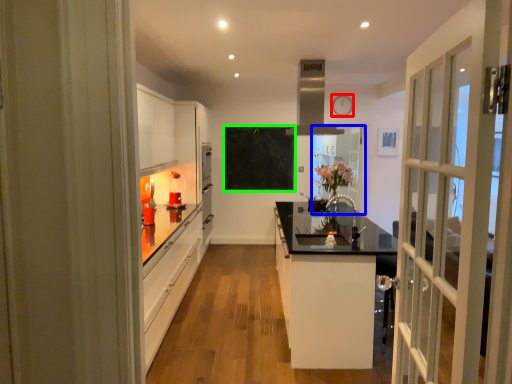
Question: Which object is the farthest from clock (highlighted by a red box)? Choose among these: window (highlighted by a blue box) or bulletin board (highlighted by a green box).

Choices:
 (A) window
 (B) bulletin board

Answer: (B)